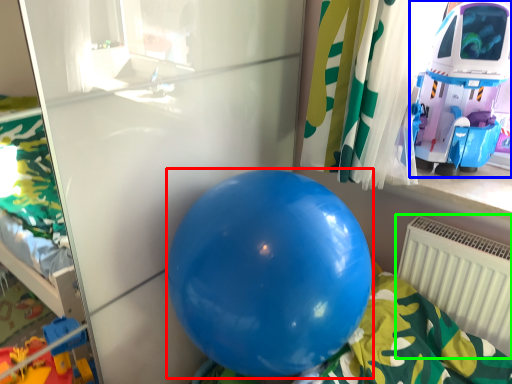
Question: Considering the real-world distances, which object is farthest from balloon (highlighted by a red box)? toy (highlighted by a blue box) or radiator (highlighted by a green box)?

Choices:
 (A) toy
 (B) radiator

Answer: (A)